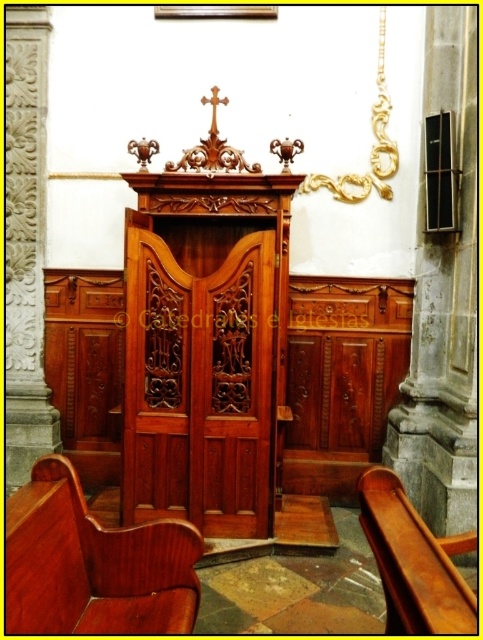
Who is more distant from viewer, (10, 628) or (405, 540)?

The point (405, 540) is behind.

Does mahogany wood bench at lower left have a lesser width compared to wooden polished chair at lower right?

No, mahogany wood bench at lower left is not thinner than wooden polished chair at lower right.

At what (x,y) coordinates should I click in order to perform the action: click on mahogany wood bench at lower left. Please return your answer as a coordinate pair (x, y). This screenshot has width=483, height=640. Looking at the image, I should click on (93, 563).

Find the location of a particular element. The width and height of the screenshot is (483, 640). polished wood door at center is located at coordinates (198, 378).

Is polished wood door at center taller than mahogany wood bench at lower left?

Correct, polished wood door at center is much taller as mahogany wood bench at lower left.

Is point (145, 392) positioned behind point (157, 593)?

Yes, it is behind point (157, 593).

The height and width of the screenshot is (640, 483). Identify the location of polished wood door at center. (198, 378).

Is polished wood door at center behind wooden polished chair at lower right?

Yes.

Who is taller, polished wood door at center or wooden polished chair at lower right?

With more height is polished wood door at center.

Identify the location of polished wood door at center. Image resolution: width=483 pixels, height=640 pixels. (198, 378).